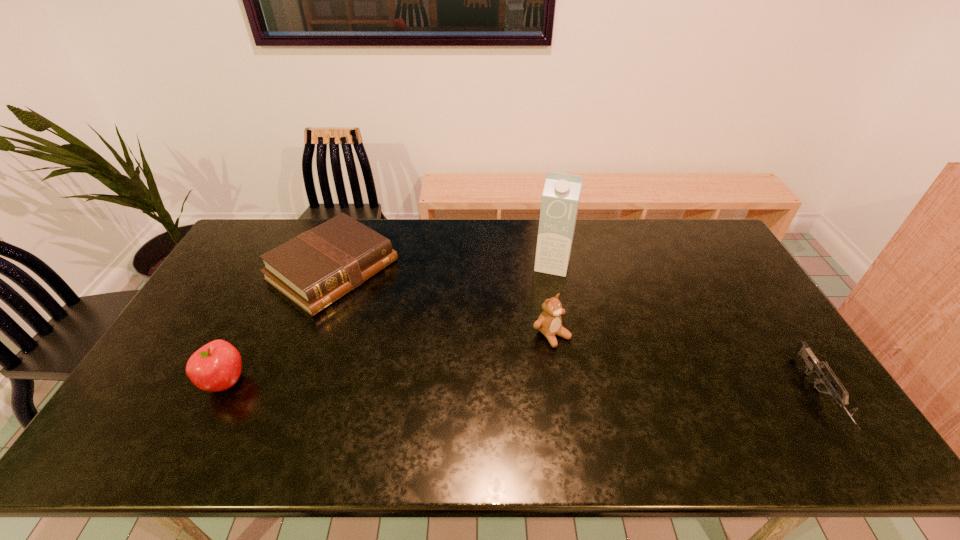
This screenshot has height=540, width=960. Find the location of `free space on the desktop that is between the apple and the shortest object and is positioned on the front label of the carton`. free space on the desktop that is between the apple and the shortest object and is positioned on the front label of the carton is located at coordinates (520, 388).

Where is `vacant space on the desktop that is between the apple and the gun and is positioned on the front-facing side of the third farthest object`? The width and height of the screenshot is (960, 540). vacant space on the desktop that is between the apple and the gun and is positioned on the front-facing side of the third farthest object is located at coordinates (608, 389).

Locate an element on the screen. Image resolution: width=960 pixels, height=540 pixels. vacant spot on the desktop that is between the apple and the gun and is positioned on the spine side of the Bible is located at coordinates (510, 387).